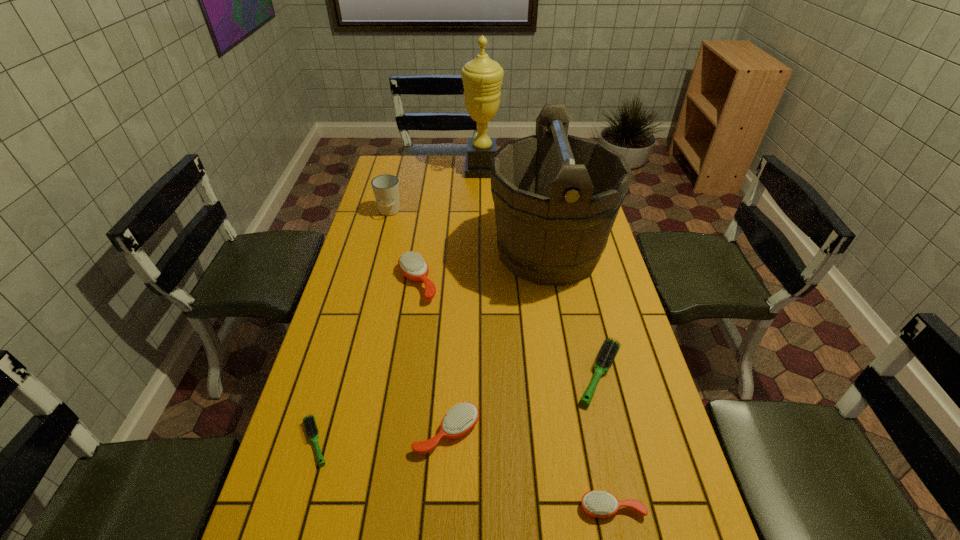
What are the coordinates of `free location at the right edge of the desktop` in the screenshot? It's located at [652, 456].

You are a GUI agent. You are given a task and a screenshot of the screen. Output one action in this format:
    pyautogui.click(x=<x>, y=<y>)
    Task: Click on the free spot between the tallest hairbrush and the right light hairbrush
    The width and height of the screenshot is (960, 540).
    Given the screenshot: What is the action you would take?
    pyautogui.click(x=508, y=328)

At what (x,y) coordinates should I click in order to perform the action: click on unoccupied position between the farther light hairbrush and the white cup. Please return your answer as a coordinate pair (x, y). The height and width of the screenshot is (540, 960). Looking at the image, I should click on (494, 293).

Locate an element on the screen. This screenshot has height=540, width=960. free spot between the right light hairbrush and the sixth shortest object is located at coordinates (494, 293).

You are a GUI agent. You are given a task and a screenshot of the screen. Output one action in this format:
    pyautogui.click(x=<x>, y=<y>)
    Task: Click on the vacant area that lies between the smallest orange hairbrush and the second smallest orange hairbrush
    This screenshot has height=540, width=960.
    Given the screenshot: What is the action you would take?
    pyautogui.click(x=529, y=470)

The height and width of the screenshot is (540, 960). I want to click on vacant point located between the bigger light hairbrush and the second tallest object, so click(574, 313).

This screenshot has width=960, height=540. I want to click on empty space between the shortest object and the cup, so click(352, 327).

Find the location of a particular element. free space between the yellow trophy cup and the left light hairbrush is located at coordinates (398, 306).

You are a GUI agent. You are given a task and a screenshot of the screen. Output one action in this format:
    pyautogui.click(x=<x>, y=<y>)
    Task: Click on the object that can be found as the closest to the right light hairbrush
    This screenshot has width=960, height=540.
    Given the screenshot: What is the action you would take?
    pyautogui.click(x=556, y=198)

Locate which object is the closest to the second farthest orange hairbrush. Please provide its 2D coordinates. Your answer should be formatted as a tuple, i.e. [(x, y)], where the tuple contains the x and y coordinates of a point satisfying the conditions above.

[(309, 422)]